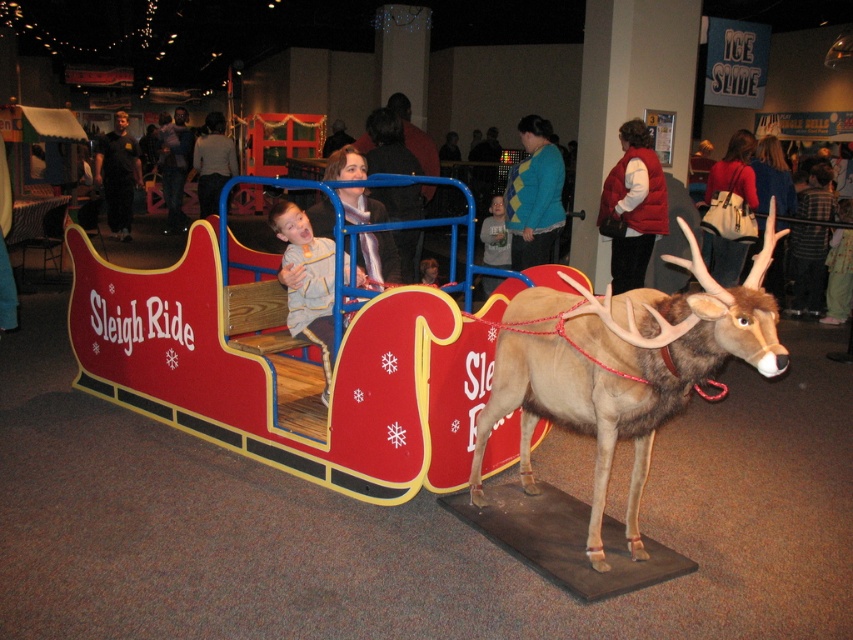
Is brown fur reindeer at center to the left of light gray sweater at center from the viewer's perspective?

No, brown fur reindeer at center is not to the left of light gray sweater at center.

Is point (614, 349) in front of point (206, 116)?

Yes, point (614, 349) is in front of point (206, 116).

The height and width of the screenshot is (640, 853). In order to click on brown fur reindeer at center in this screenshot , I will do pyautogui.click(x=622, y=369).

Is brown fur reindeer at center above teal sweater at center?

Incorrect, brown fur reindeer at center is not positioned above teal sweater at center.

Measure the distance between brown fur reindeer at center and teal sweater at center.

brown fur reindeer at center is 2.69 meters from teal sweater at center.

Describe the element at coordinates (622, 369) in the screenshot. This screenshot has width=853, height=640. I see `brown fur reindeer at center` at that location.

Where is `brown fur reindeer at center`? brown fur reindeer at center is located at coordinates (622, 369).

Is teal sweater at center positioned behind matte gray sweater at center?

Yes.

Is point (538, 237) less distant than point (390, 237)?

No.

The height and width of the screenshot is (640, 853). Describe the element at coordinates (534, 195) in the screenshot. I see `teal sweater at center` at that location.

This screenshot has width=853, height=640. In order to click on teal sweater at center in this screenshot , I will do `click(534, 195)`.